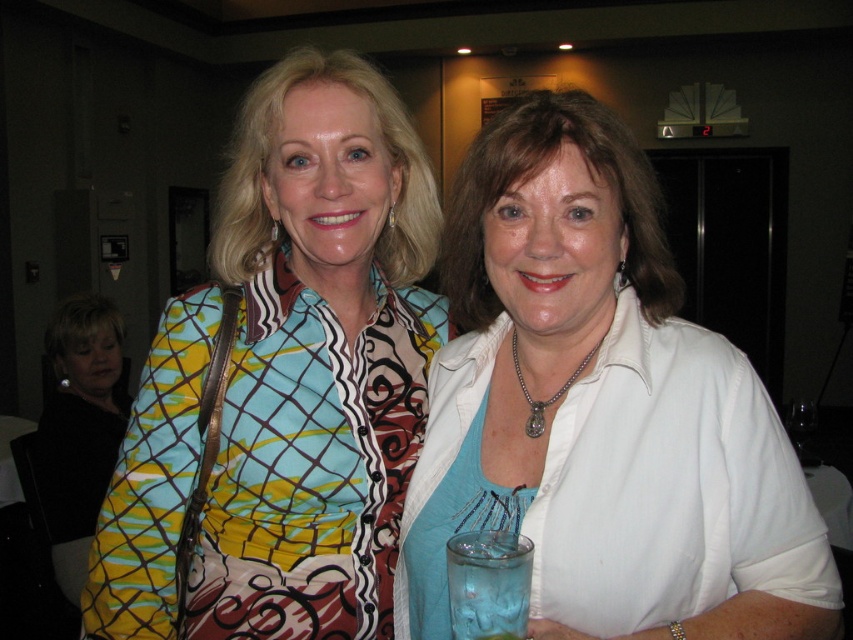
Question: Which point is closer to the camera?

Choices:
 (A) (490, 605)
 (B) (498, 252)
 (C) (358, 468)

Answer: (A)

Question: Is white glossy shirt at center closer to the viewer compared to printed fabric blouse at center?

Choices:
 (A) yes
 (B) no

Answer: (A)

Question: Which of these objects is positioned farthest from the transparent glass at center?

Choices:
 (A) white glossy shirt at center
 (B) printed fabric blouse at center

Answer: (B)

Question: Which point is farther to the camera?

Choices:
 (A) (268, 348)
 (B) (538, 404)

Answer: (A)

Question: Is printed fabric blouse at center bigger than transparent glass at center?

Choices:
 (A) no
 (B) yes

Answer: (B)

Question: Is white glossy shirt at center to the right of transparent glass at center from the viewer's perspective?

Choices:
 (A) no
 (B) yes

Answer: (B)